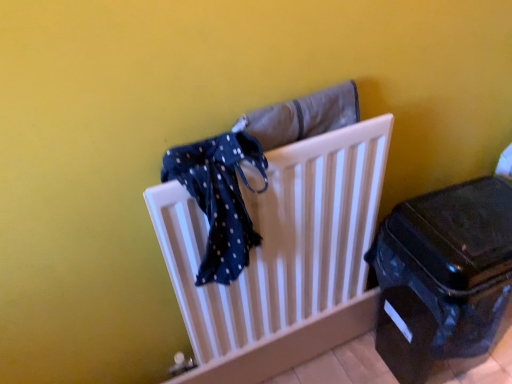
This screenshot has width=512, height=384. What do you see at coordinates (443, 275) in the screenshot?
I see `shiny black suitcase at lower right` at bounding box center [443, 275].

Describe the element at coordinates (219, 198) in the screenshot. I see `blue dotted fabric at center` at that location.

The height and width of the screenshot is (384, 512). I want to click on blue dotted fabric at center, so click(219, 198).

I want to click on shiny black suitcase at lower right, so (x=443, y=275).

Which object is closer to the camera taking this photo, blue dotted fabric at center or white plastic radiator at center?

blue dotted fabric at center.

Based on the photo, could you tell me if blue dotted fabric at center is turned towards white plastic radiator at center?

Yes, blue dotted fabric at center is facing white plastic radiator at center.

Considering the sizes of objects blue dotted fabric at center and white plastic radiator at center in the image provided, who is wider, blue dotted fabric at center or white plastic radiator at center?

With larger width is blue dotted fabric at center.

Are blue dotted fabric at center and white plastic radiator at center far apart?

blue dotted fabric at center is actually quite close to white plastic radiator at center.

Can you confirm if shiny black suitcase at lower right is wider than white plastic radiator at center?

Indeed, shiny black suitcase at lower right has a greater width compared to white plastic radiator at center.

Measure the distance from shiny black suitcase at lower right to white plastic radiator at center.

The distance of shiny black suitcase at lower right from white plastic radiator at center is 10.37 inches.

In terms of size, does shiny black suitcase at lower right appear bigger or smaller than white plastic radiator at center?

In the image, shiny black suitcase at lower right appears to be larger than white plastic radiator at center.

Is shiny black suitcase at lower right positioned with its back to white plastic radiator at center?

No, white plastic radiator at center is not at the back of shiny black suitcase at lower right.

Is white plastic radiator at center turned away from shiny black suitcase at lower right?

No, shiny black suitcase at lower right is not at the back of white plastic radiator at center.

Identify the location of furniture located above the shiny black suitcase at lower right (from the image's perspective). The width and height of the screenshot is (512, 384). (282, 258).

Considering the sizes of white plastic radiator at center and shiny black suitcase at lower right in the image, is white plastic radiator at center taller or shorter than shiny black suitcase at lower right?

white plastic radiator at center is shorter than shiny black suitcase at lower right.

Is white plastic radiator at center positioned far away from shiny black suitcase at lower right?

No.

From a real-world perspective, which object stands above the other?

blue dotted fabric at center, from a real-world perspective.

Is white plastic radiator at center positioned far away from blue dotted fabric at center?

They are positioned close to each other.

Between white plastic radiator at center and blue dotted fabric at center, which one has larger width?

blue dotted fabric at center.

From their relative heights in the image, would you say white plastic radiator at center is taller or shorter than blue dotted fabric at center?

In the image, white plastic radiator at center appears to be taller than blue dotted fabric at center.

Does blue dotted fabric at center have a lesser height compared to shiny black suitcase at lower right?

Indeed, blue dotted fabric at center has a lesser height compared to shiny black suitcase at lower right.

Would you say blue dotted fabric at center is to the left or to the right of shiny black suitcase at lower right in the picture?

blue dotted fabric at center is to the left of shiny black suitcase at lower right.

Who is bigger, blue dotted fabric at center or shiny black suitcase at lower right?

Bigger between the two is shiny black suitcase at lower right.

Can you confirm if blue dotted fabric at center is wider than shiny black suitcase at lower right?

No, blue dotted fabric at center is not wider than shiny black suitcase at lower right.

Between shiny black suitcase at lower right and blue dotted fabric at center, which one has more height?

shiny black suitcase at lower right.

From the image's perspective, who appears lower, shiny black suitcase at lower right or blue dotted fabric at center?

shiny black suitcase at lower right appears lower in the image.

Which of these two, shiny black suitcase at lower right or blue dotted fabric at center, is bigger?

Bigger between the two is shiny black suitcase at lower right.

Is point (372, 252) in front of point (217, 214)?

No, (372, 252) is further to viewer.

Where is `furniture below the blue dotted fabric at center (from the image's perspective)`? Image resolution: width=512 pixels, height=384 pixels. furniture below the blue dotted fabric at center (from the image's perspective) is located at coordinates (282, 258).

Find the location of a particular element. The image size is (512, 384). furniture above the shiny black suitcase at lower right (from the image's perspective) is located at coordinates (282, 258).

Which object lies nearer to the anchor point white plastic radiator at center, shiny black suitcase at lower right or blue dotted fabric at center?

blue dotted fabric at center.

Based on their spatial positions, is white plastic radiator at center or shiny black suitcase at lower right further from blue dotted fabric at center?

Based on the image, shiny black suitcase at lower right appears to be further to blue dotted fabric at center.

Based on their spatial positions, is shiny black suitcase at lower right or white plastic radiator at center closer to blue dotted fabric at center?

white plastic radiator at center is positioned closer to the anchor blue dotted fabric at center.

Looking at the image, which one is located closer to shiny black suitcase at lower right, white plastic radiator at center or blue dotted fabric at center?

The object closer to shiny black suitcase at lower right is white plastic radiator at center.

When comparing their distances from shiny black suitcase at lower right, does blue dotted fabric at center or white plastic radiator at center seem further?

Based on the image, blue dotted fabric at center appears to be further to shiny black suitcase at lower right.

From the image, which object appears to be nearer to white plastic radiator at center, blue dotted fabric at center or shiny black suitcase at lower right?

blue dotted fabric at center is closer to white plastic radiator at center.

You are a GUI agent. You are given a task and a screenshot of the screen. Output one action in this format:
    pyautogui.click(x=<x>, y=<y>)
    Task: Click on the furniture between blue dotted fabric at center and shiny black suitcase at lower right from left to right
    This screenshot has height=384, width=512.
    Given the screenshot: What is the action you would take?
    pyautogui.click(x=282, y=258)